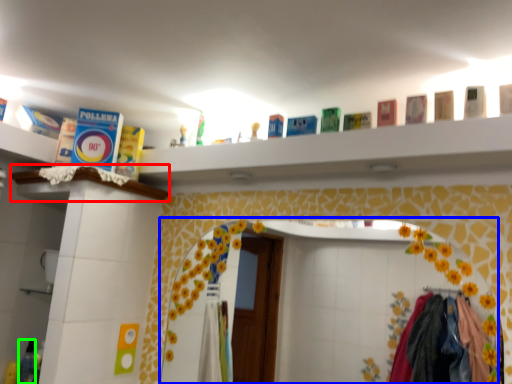
Question: Estimate the real-world distances between objects in this image. Which object is closer to ledge (highlighted by a red box), mirror (highlighted by a blue box) or toiletry (highlighted by a green box)?

Choices:
 (A) mirror
 (B) toiletry

Answer: (B)